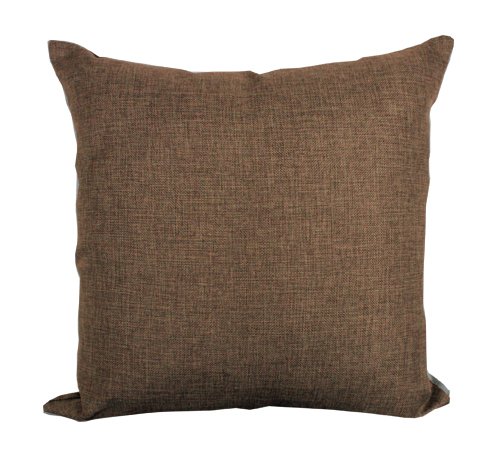
The height and width of the screenshot is (460, 494). I want to click on corners, so click(x=72, y=57), click(x=437, y=51), click(x=432, y=400), click(x=66, y=412).